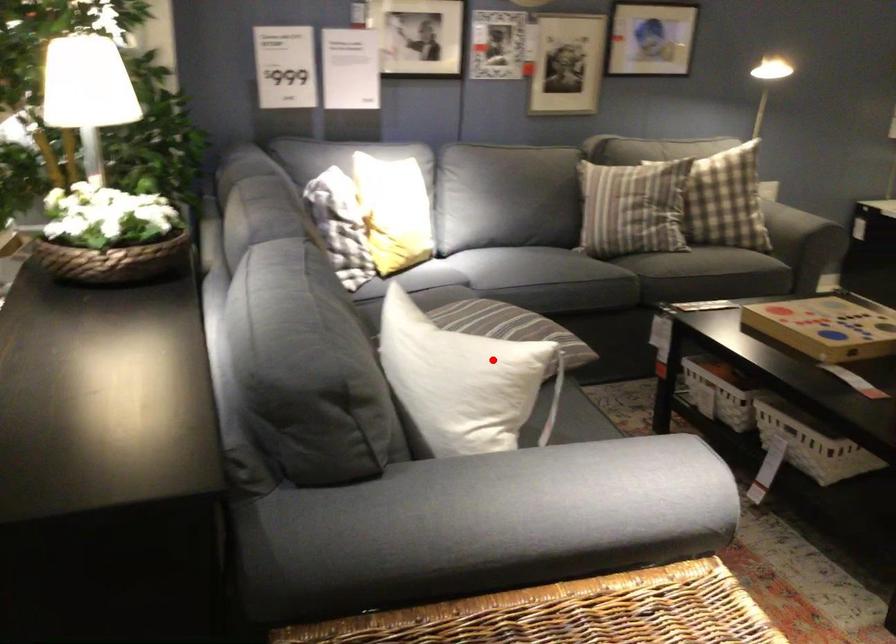
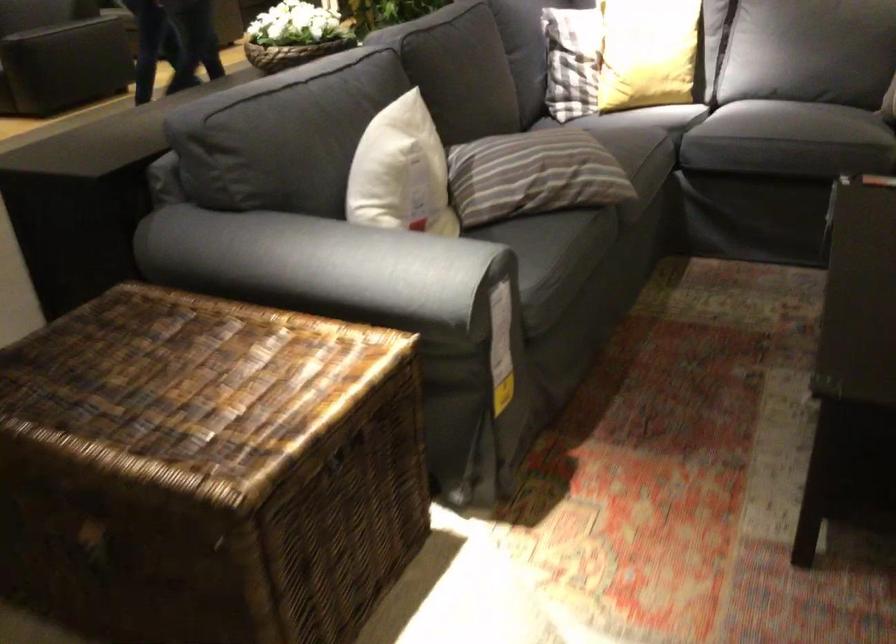
Question: A red point is marked in image1. In image2, is the corresponding 3D point closer to the camera or farther? Reply with the corresponding letter.

Choices:
 (A) The corresponding 3D point is closer.
 (B) The corresponding 3D point is farther.

Answer: (B)